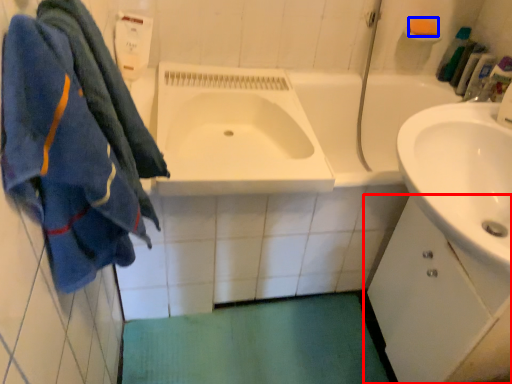
Question: Which object appears closest to the camera in this image, bathroom cabinet (highlighted by a red box) or soap (highlighted by a blue box)?

Choices:
 (A) bathroom cabinet
 (B) soap

Answer: (A)